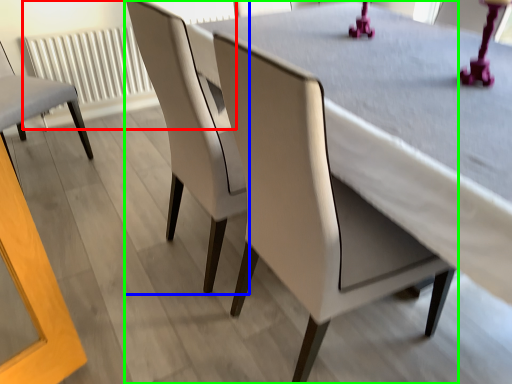
Question: Based on their relative distances, which object is nearer to radiator (highlighted by a red box)? Choose from chair (highlighted by a blue box) and chair (highlighted by a green box).

Choices:
 (A) chair
 (B) chair

Answer: (A)